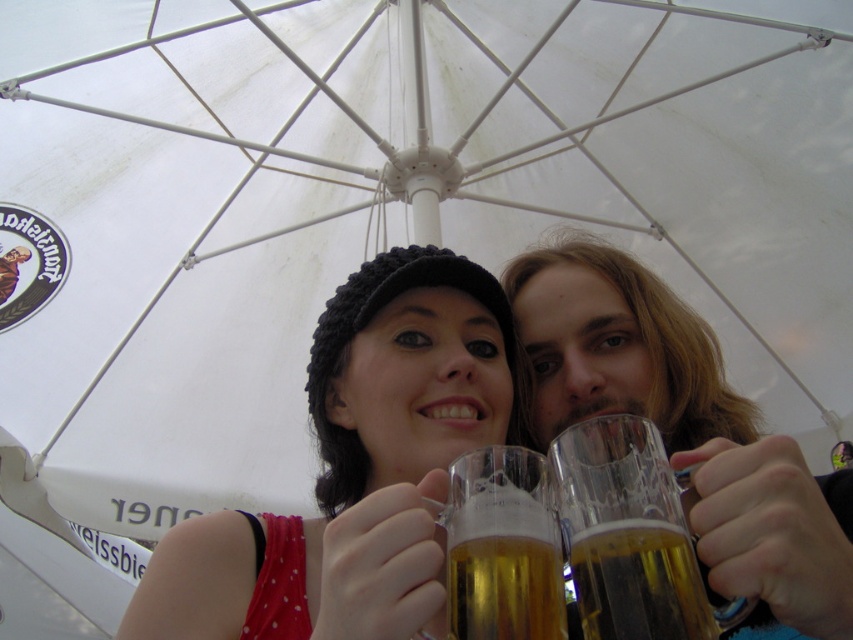
Is translucent glass mug at upper right to the left of golden glass mug at center from the viewer's perspective?

In fact, translucent glass mug at upper right is to the right of golden glass mug at center.

Is translucent glass mug at upper right shorter than golden glass mug at center?

In fact, translucent glass mug at upper right may be taller than golden glass mug at center.

Where is `translucent glass mug at upper right`? The image size is (853, 640). translucent glass mug at upper right is located at coordinates 686,429.

Is matte black beanie at center above translucent glass mug at center?

Yes, matte black beanie at center is above translucent glass mug at center.

Does matte black beanie at center appear on the right side of translucent glass mug at center?

No, matte black beanie at center is not to the right of translucent glass mug at center.

Locate an element on the screen. matte black beanie at center is located at coordinates (352, 467).

Between point (746, 483) and point (531, 452), which one is positioned behind?

Positioned behind is point (531, 452).

Is translucent glass mug at upper right above translucent glass mug at center?

Indeed, translucent glass mug at upper right is positioned over translucent glass mug at center.

Image resolution: width=853 pixels, height=640 pixels. I want to click on translucent glass mug at upper right, so click(686, 429).